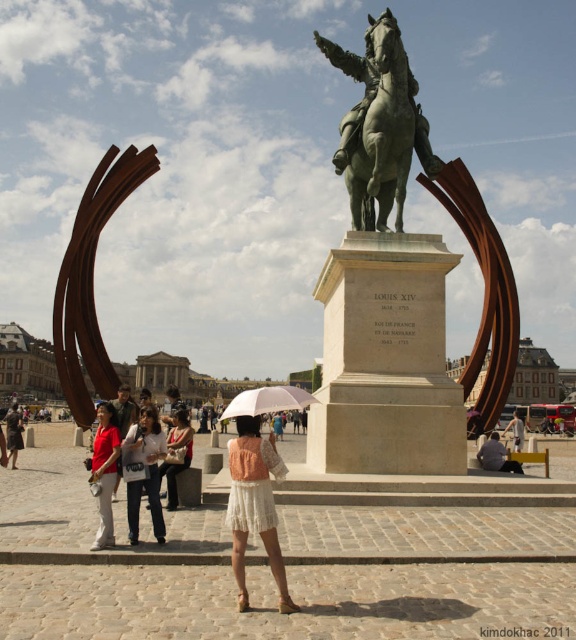
You are a photographer planning to capture a photo of the historical square. You notice two white items at the center of the scene. Which one is shorter between the white lace dress at center and the white matte umbrella at center?

The white lace dress at center is shorter than the white matte umbrella at center.

You are a tourist standing in the historical square. You see the bronze statue of horse at center and the white cotton shirt at center. Which object is closer to you?

The bronze statue of horse at center is closer to you because the white cotton shirt at center is behind it.

You are a photographer planning to capture a photo of the historical square. You want to ensure both the white lace dress at center and the white matte umbrella at center are fully visible in the frame. Given their sizes, which object might require you to adjust your camera angle to avoid cropping?

The white lace dress at center is narrower than the white matte umbrella at center. Since the umbrella is wider, you might need to adjust your camera angle to ensure it fits entirely in the frame without cropping.